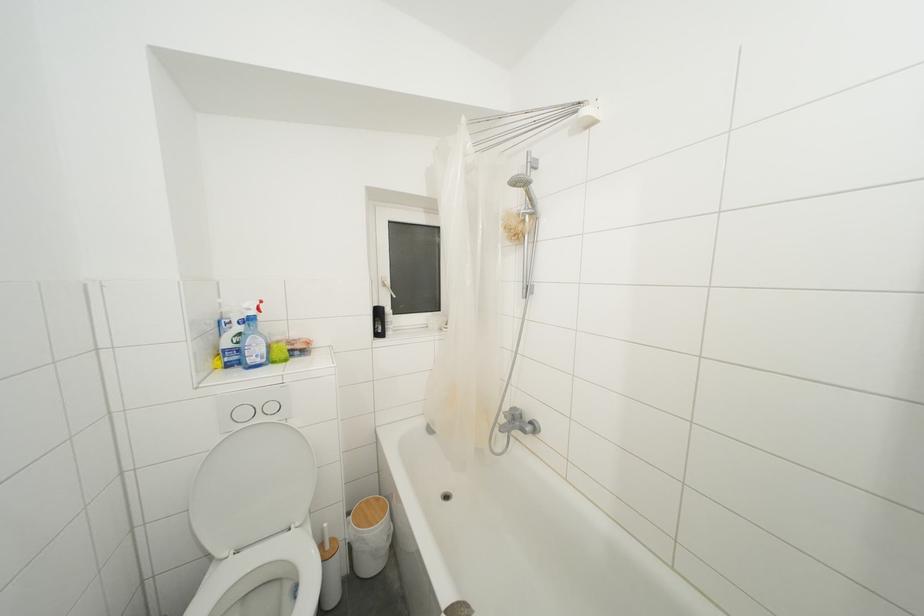
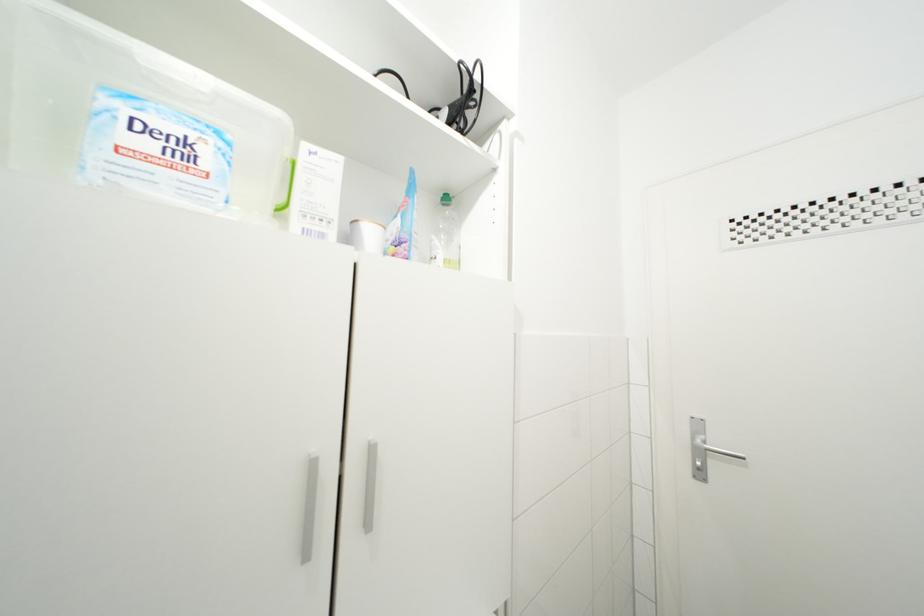
Question: The camera is either moving clockwise (left) or counter-clockwise (right) around the object. The first image is from the beginning of the video and the second image is from the end. Is the camera moving left or right when shooting the video?

Choices:
 (A) Left
 (B) Right

Answer: (A)